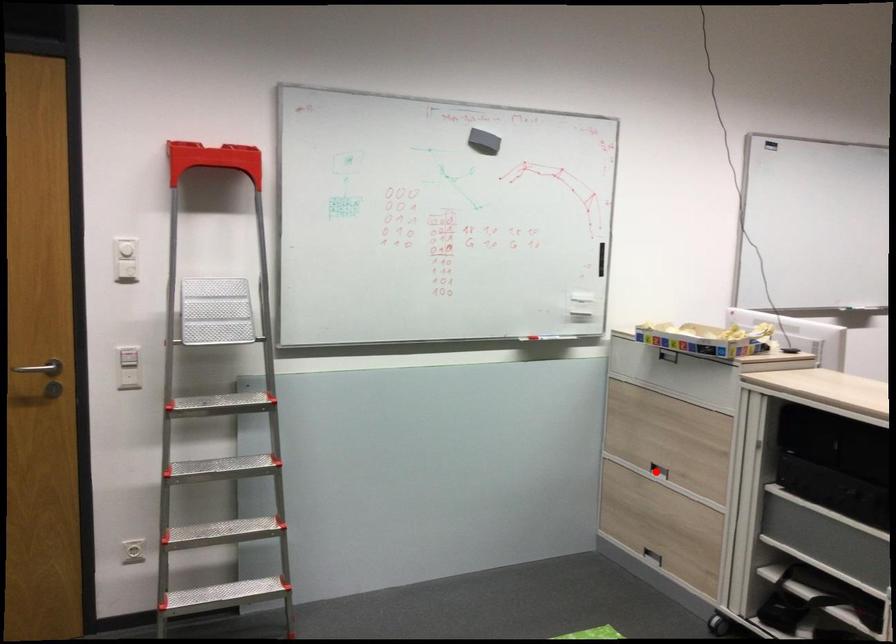
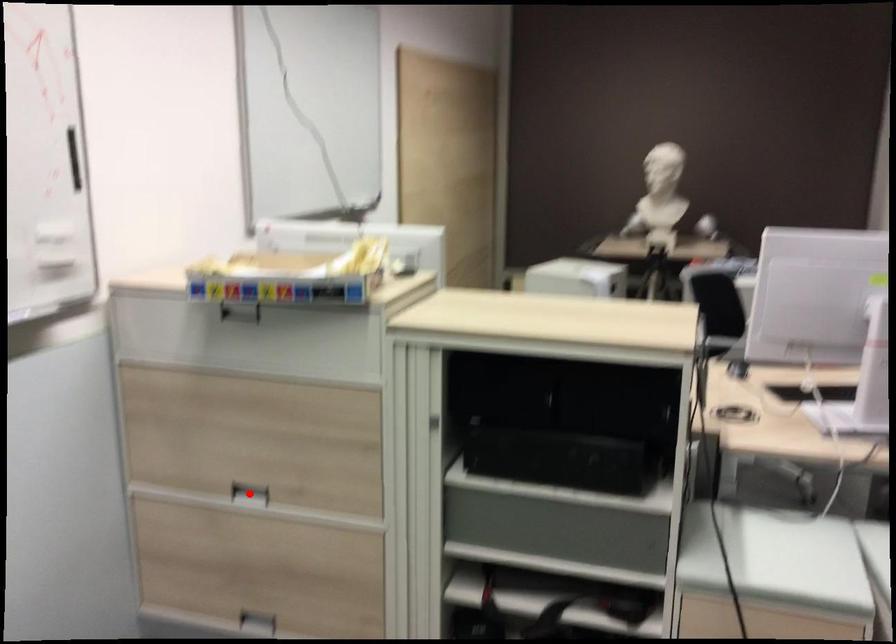
I am providing you with two images of the same scene from different viewpoints. A red point is marked on the first image and another point is marked on the second image. Is the red point in image1 aligned with the point shown in image2?

Yes